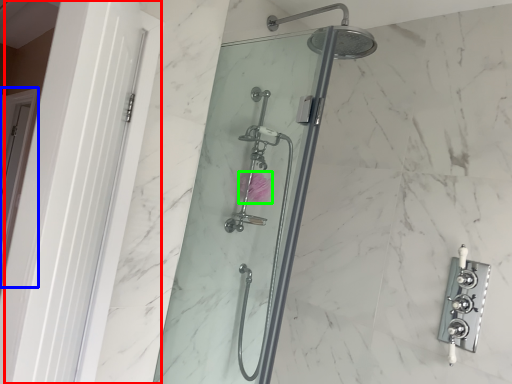
Question: Considering the real-world distances, which object is closest to screen door (highlighted by a red box)? screen door (highlighted by a blue box) or flower (highlighted by a green box).

Choices:
 (A) screen door
 (B) flower

Answer: (B)